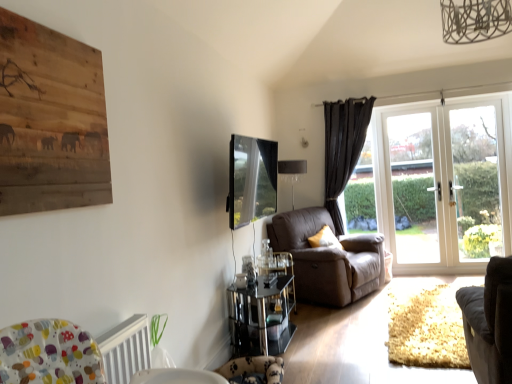
Describe the element at coordinates (125, 349) in the screenshot. I see `white textured radiator at lower left` at that location.

This screenshot has height=384, width=512. Describe the element at coordinates (489, 323) in the screenshot. I see `velvet dark gray armchair at lower right, marked as the first chair in a front-to-back arrangement` at that location.

Describe the element at coordinates (325, 239) in the screenshot. I see `yellow fabric pillow at center` at that location.

The height and width of the screenshot is (384, 512). What do you see at coordinates (261, 318) in the screenshot?
I see `polished glass table at center` at bounding box center [261, 318].

Image resolution: width=512 pixels, height=384 pixels. What do you see at coordinates (442, 185) in the screenshot?
I see `white glass door at right` at bounding box center [442, 185].

At what (x,y) coordinates should I click in order to perform the action: click on matte glass lampshade at upper center. Please return your answer as a coordinate pair (x, y). The width and height of the screenshot is (512, 384). Looking at the image, I should click on point(292,172).

Find the location of a particular element. white textured radiator at lower left is located at coordinates (125, 349).

Could you tell me if black velvet curtain at right is facing wooden painting at upper left?

Yes, black velvet curtain at right is oriented towards wooden painting at upper left.

Which object is positioned more to the left, black velvet curtain at right or wooden painting at upper left?

wooden painting at upper left is more to the left.

Identify the location of picture frame that is in front of the black velvet curtain at right. (50, 120).

Which of these two, black velvet curtain at right or wooden painting at upper left, stands shorter?

wooden painting at upper left.

Is point (366, 249) closer to viewer compared to point (35, 187)?

No.

From the image's perspective, who appears lower, brown leather couch at center, which appears as the second chair when viewed from the front, or wooden painting at upper left?

brown leather couch at center, which appears as the second chair when viewed from the front, is shown below in the image.

Does brown leather couch at center, which appears as the second chair when viewed from the front, have a smaller size compared to wooden painting at upper left?

No, brown leather couch at center, which appears as the second chair when viewed from the front, is not smaller than wooden painting at upper left.

Are brown leather couch at center, which appears as the second chair when viewed from the front, and wooden painting at upper left making contact?

No, brown leather couch at center, which appears as the second chair when viewed from the front, is not in contact with wooden painting at upper left.

From the image's perspective, which one is positioned lower, white glass door at right or matte glass lampshade at upper center?

white glass door at right.

Between white glass door at right and matte glass lampshade at upper center, which one has less height?

matte glass lampshade at upper center is shorter.

The image size is (512, 384). What are the coordinates of `window below the matte glass lampshade at upper center (from a real-world perspective)` in the screenshot? It's located at (442, 185).

Is white glass door at right looking in the opposite direction of matte glass lampshade at upper center?

white glass door at right does not have its back to matte glass lampshade at upper center.

Is brown leather couch at center, which is counted as the 1th chair, starting from the back, bigger than polished glass table at center?

Indeed, brown leather couch at center, which is counted as the 1th chair, starting from the back, has a larger size compared to polished glass table at center.

Can you confirm if brown leather couch at center, which is counted as the 1th chair, starting from the back, is positioned to the left of polished glass table at center?

No, brown leather couch at center, which is counted as the 1th chair, starting from the back, is not to the left of polished glass table at center.

In the scene shown: Is brown leather couch at center, which appears as the second chair when viewed from the front, facing towards polished glass table at center?

No, brown leather couch at center, which appears as the second chair when viewed from the front, is not oriented towards polished glass table at center.

From a real-world perspective, is white textured radiator at lower left below wooden painting at upper left?

Yes, from a real-world perspective, white textured radiator at lower left is below wooden painting at upper left.

Considering the positions of objects white textured radiator at lower left and wooden painting at upper left in the image provided, who is in front, white textured radiator at lower left or wooden painting at upper left?

wooden painting at upper left.

Is white textured radiator at lower left looking in the opposite direction of wooden painting at upper left?

No, white textured radiator at lower left's orientation is not away from wooden painting at upper left.

What's the angular difference between yellow fabric pillow at center and wooden painting at upper left's facing directions?

25.2 degrees.

At what (x,y) coordinates should I click in order to perform the action: click on picture frame above the yellow fabric pillow at center (from the image's perspective). Please return your answer as a coordinate pair (x, y). Looking at the image, I should click on (50, 120).

From the picture: From the image's perspective, is yellow fabric pillow at center over wooden painting at upper left?

No, from the image's perspective, yellow fabric pillow at center is not above wooden painting at upper left.

Between point (317, 244) and point (46, 149), which one is positioned behind?

The point (317, 244) is behind.

Which object is further away from the camera taking this photo, brown leather couch at center, which appears as the second chair when viewed from the front, or fluffy fabric swivel chair at lower center?

Positioned behind is brown leather couch at center, which appears as the second chair when viewed from the front.

Is point (298, 216) more distant than point (251, 381)?

Yes, point (298, 216) is farther from viewer.

Is brown leather couch at center, which is counted as the 1th chair, starting from the back, turned away from fluffy fabric swivel chair at lower center?

No, brown leather couch at center, which is counted as the 1th chair, starting from the back, is not facing the opposite direction of fluffy fabric swivel chair at lower center.

From the image's perspective, between brown leather couch at center, which is counted as the 1th chair, starting from the back, and fluffy fabric swivel chair at lower center, who is located below?

fluffy fabric swivel chair at lower center appears lower in the image.

Image resolution: width=512 pixels, height=384 pixels. Identify the location of curtain below the wooden painting at upper left (from the image's perspective). (343, 148).

This screenshot has width=512, height=384. In order to click on chair that is the 1st object to the right of the wooden painting at upper left, starting at the anchor in this screenshot , I will do pyautogui.click(x=328, y=258).

Looking at the image, which one is located closer to white glass screen door at right, the second screen door viewed from the right, wooden painting at upper left or fluffy fabric swivel chair at lower center?

Among the two, fluffy fabric swivel chair at lower center is located nearer to white glass screen door at right, the second screen door viewed from the right.

Based on their spatial positions, is matte black tv at center or matte glass lampshade at upper center closer to white glass door at right?

matte glass lampshade at upper center is positioned closer to the anchor white glass door at right.

Based on their spatial positions, is fluffy fabric swivel chair at lower center or yellow fabric pillow at center closer to white textured radiator at lower left?

fluffy fabric swivel chair at lower center.

Estimate the real-world distances between objects in this image. Which object is further from clear glass door at right, positioned as the 2th screen door in left-to-right order, white glass screen door at right, the second screen door viewed from the right, or matte glass lampshade at upper center?

Based on the image, matte glass lampshade at upper center appears to be further to clear glass door at right, positioned as the 2th screen door in left-to-right order.

Looking at the image, which one is located further to matte glass lampshade at upper center, velvet dark gray armchair at lower right, marked as the first chair in a front-to-back arrangement, or polished glass table at center?

velvet dark gray armchair at lower right, marked as the first chair in a front-to-back arrangement, is further to matte glass lampshade at upper center.

Considering their positions, is wooden painting at upper left positioned further to polished glass table at center than white glass door at right?

Among the two, white glass door at right is located further to polished glass table at center.

Based on their spatial positions, is velvet dark gray armchair at lower right, which is counted as the 2th chair, starting from the back, or brown leather couch at center, which is counted as the 1th chair, starting from the back, further from white glass screen door at right, the second screen door viewed from the right?

Based on the image, velvet dark gray armchair at lower right, which is counted as the 2th chair, starting from the back, appears to be further to white glass screen door at right, the second screen door viewed from the right.

Considering their positions, is wooden painting at upper left positioned further to matte black tv at center than yellow fabric pillow at center?

wooden painting at upper left lies further to matte black tv at center than the other object.

You are a GUI agent. You are given a task and a screenshot of the screen. Output one action in this format:
    pyautogui.click(x=<x>, y=<y>)
    Task: Click on the window screen located between fluffy fabric swivel chair at lower center and matte glass lampshade at upper center in the depth direction
    The width and height of the screenshot is (512, 384).
    Given the screenshot: What is the action you would take?
    pyautogui.click(x=251, y=180)

This screenshot has height=384, width=512. What are the coordinates of `table located between wooden painting at upper left and black velvet curtain at right in the depth direction` in the screenshot? It's located at (261, 318).

The width and height of the screenshot is (512, 384). What are the coordinates of `pillow located between matte black tv at center and matte glass lampshade at upper center in the depth direction` in the screenshot? It's located at (325, 239).

Identify the location of swivel chair between velvet dark gray armchair at lower right, which is counted as the 2th chair, starting from the back, and brown leather couch at center, which is counted as the 1th chair, starting from the back, from front to back. The image size is (512, 384). (253, 370).